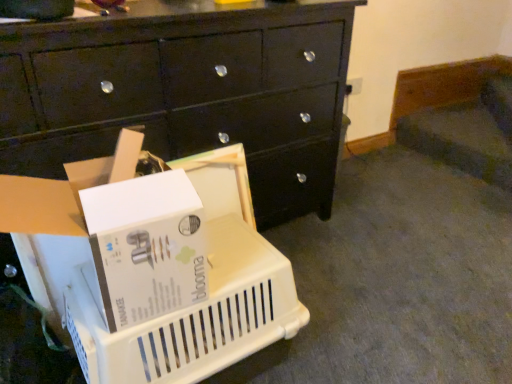
Locate an element on the screen. Image resolution: width=512 pixels, height=384 pixels. vacant space to the right of white plastic basket at lower left is located at coordinates (352, 321).